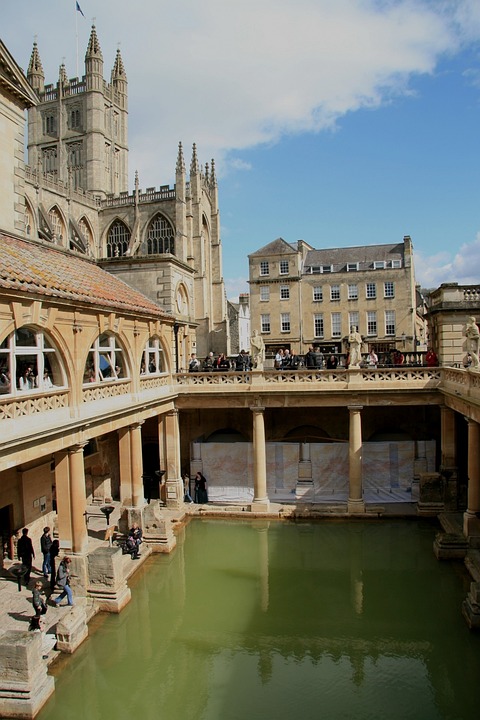
Where is `stair`? The image size is (480, 720). stair is located at coordinates (127, 559).